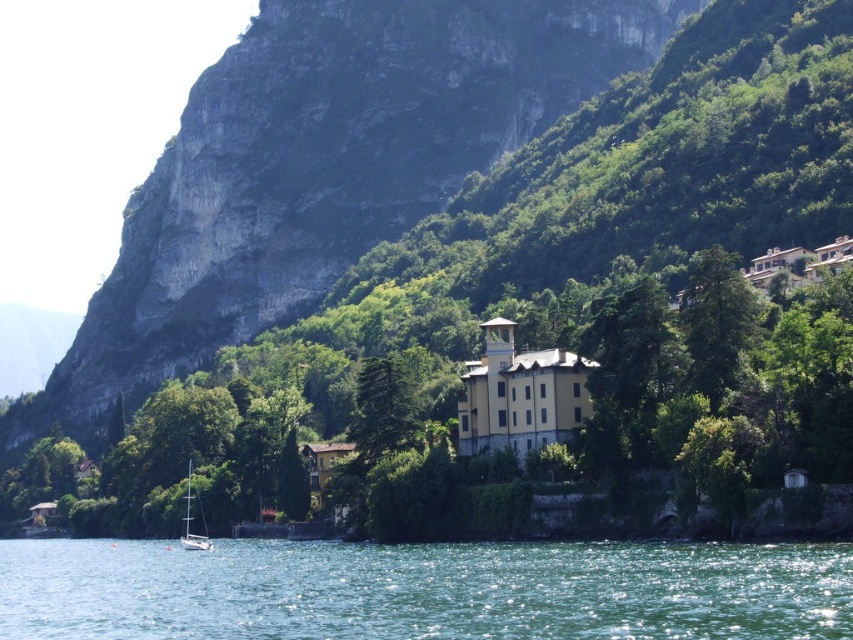
Does rocky cliff at upper left appear over green liquid water at lower center?

Yes, rocky cliff at upper left is above green liquid water at lower center.

From the picture: Who is higher up, rocky cliff at upper left or green liquid water at lower center?

rocky cliff at upper left is above.

Identify the location of rocky cliff at upper left. (323, 166).

Identify the location of rocky cliff at upper left. (323, 166).

Is green leafy tree at center above green liquid water at lower center?

Yes, green leafy tree at center is above green liquid water at lower center.

Between point (288, 326) and point (776, 632), which one is positioned in front?

Point (776, 632)

Identify the location of green leafy tree at center. This screenshot has width=853, height=640. (494, 417).

Which of these two, green leafy tree at center or rocky cliff at upper left, stands taller?

rocky cliff at upper left

Who is positioned more to the left, green leafy tree at center or rocky cliff at upper left?

From the viewer's perspective, rocky cliff at upper left appears more on the left side.

Identify the location of green leafy tree at center. (494, 417).